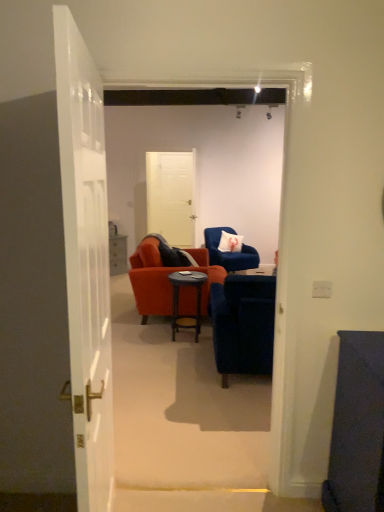
Question: Could you tell me if white matte door at center, the 2th door ordered from the bottom, is facing dark wood side table at center?

Choices:
 (A) no
 (B) yes

Answer: (B)

Question: Is white matte door at center, the 2th door ordered from the bottom, not inside dark wood side table at center?

Choices:
 (A) yes
 (B) no

Answer: (A)

Question: From a real-world perspective, is white matte door at center, the 2th door ordered from the bottom, over dark wood side table at center?

Choices:
 (A) yes
 (B) no

Answer: (A)

Question: Can you confirm if white matte door at center, which appears as the second door when viewed from the front, is thinner than dark wood side table at center?

Choices:
 (A) no
 (B) yes

Answer: (B)

Question: From the image's perspective, is white matte door at center, the 2th door ordered from the bottom, above dark wood side table at center?

Choices:
 (A) no
 (B) yes

Answer: (B)

Question: Does point (243, 237) appear closer or farther from the camera than point (94, 274)?

Choices:
 (A) farther
 (B) closer

Answer: (A)

Question: Would you say white fabric pillow at center is inside or outside white glossy door at left, arranged as the 2th door when viewed from the back?

Choices:
 (A) inside
 (B) outside

Answer: (B)

Question: In terms of height, does white fabric pillow at center look taller or shorter compared to white glossy door at left, marked as the first door in a front-to-back arrangement?

Choices:
 (A) tall
 (B) short

Answer: (B)

Question: From a real-world perspective, is white fabric pillow at center physically located above or below white glossy door at left, marked as the first door in a front-to-back arrangement?

Choices:
 (A) below
 (B) above

Answer: (A)

Question: Considering their positions, is white glossy door at left, marked as the first door in a front-to-back arrangement, located in front of or behind velvet blue armchair at center, marked as the first chair in a back-to-front arrangement?

Choices:
 (A) front
 (B) behind

Answer: (A)

Question: Would you say white glossy door at left, the 1th door from the bottom, is to the left or to the right of velvet blue armchair at center, which is the 2th chair from front to back, in the picture?

Choices:
 (A) left
 (B) right

Answer: (A)

Question: Is white glossy door at left, marked as the first door in a front-to-back arrangement, inside or outside of velvet blue armchair at center, marked as the first chair in a back-to-front arrangement?

Choices:
 (A) inside
 (B) outside

Answer: (B)

Question: From a real-world perspective, is white glossy door at left, the 2th door viewed from the top, physically located above or below velvet blue armchair at center, marked as the first chair in a back-to-front arrangement?

Choices:
 (A) above
 (B) below

Answer: (A)

Question: Considering their positions, is white glossy door at left, the 2th door viewed from the top, located in front of or behind velvet blue armchair at center, which appears as the 1th chair when viewed from the front?

Choices:
 (A) behind
 (B) front

Answer: (B)

Question: Based on their positions, is white glossy door at left, the 1th door from the bottom, located to the left or right of velvet blue armchair at center, which appears as the 1th chair when viewed from the front?

Choices:
 (A) right
 (B) left

Answer: (B)